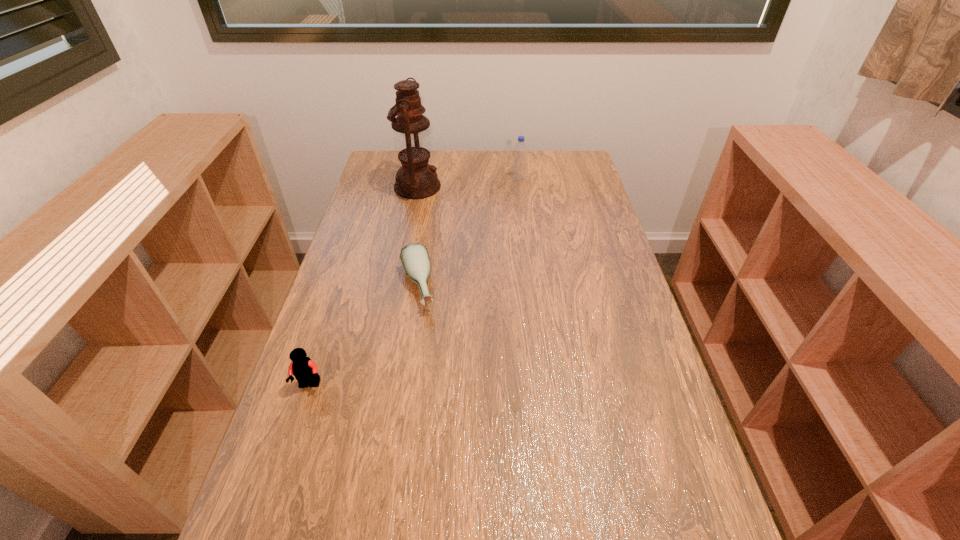
Where is `blank area located 0.310m on the front of the shorter bottle`? blank area located 0.310m on the front of the shorter bottle is located at coordinates (396, 426).

The height and width of the screenshot is (540, 960). I want to click on oil lamp positioned at the far edge, so click(416, 179).

Find the location of `bottle positioned at the far edge`. bottle positioned at the far edge is located at coordinates (520, 150).

This screenshot has height=540, width=960. Identify the location of oil lamp that is at the left edge. (416, 179).

At what (x,y) coordinates should I click in order to perform the action: click on Lego positioned at the left edge. Please return your answer as a coordinate pair (x, y). The width and height of the screenshot is (960, 540). Looking at the image, I should click on (305, 371).

Find the location of a particular element. This screenshot has height=540, width=960. object located at the far left corner is located at coordinates (416, 179).

You are a GUI agent. You are given a task and a screenshot of the screen. Output one action in this format:
    pyautogui.click(x=<x>, y=<y>)
    Task: Click on the vacant region at the far edge
    
    Given the screenshot: What is the action you would take?
    point(476,152)

Identify the location of vacant space at the left edge. The width and height of the screenshot is (960, 540). (362, 224).

Where is `vacant space at the right edge of the desktop`? The image size is (960, 540). vacant space at the right edge of the desktop is located at coordinates (572, 190).

The image size is (960, 540). Find the location of `vacant space that is in between the leftmost object and the tallest object`. vacant space that is in between the leftmost object and the tallest object is located at coordinates (364, 286).